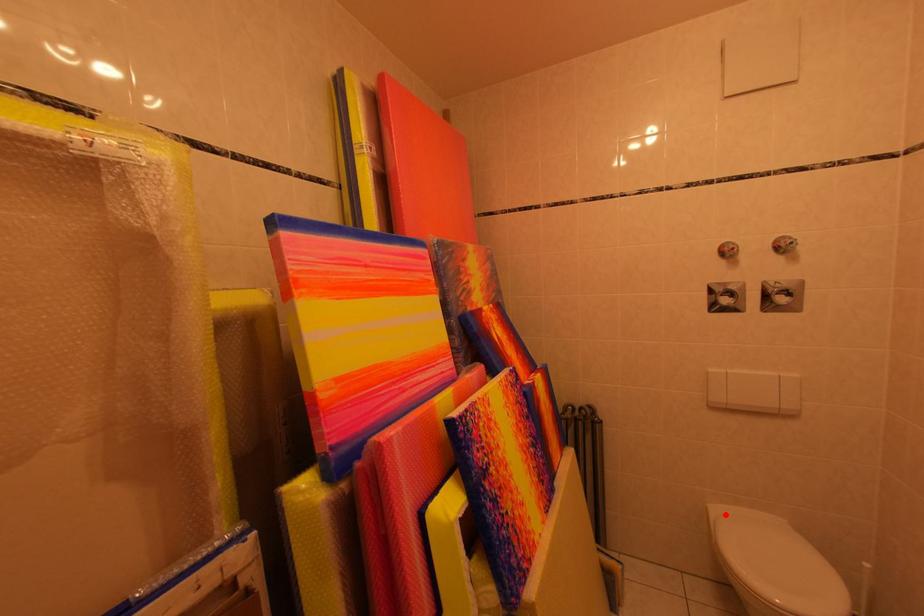
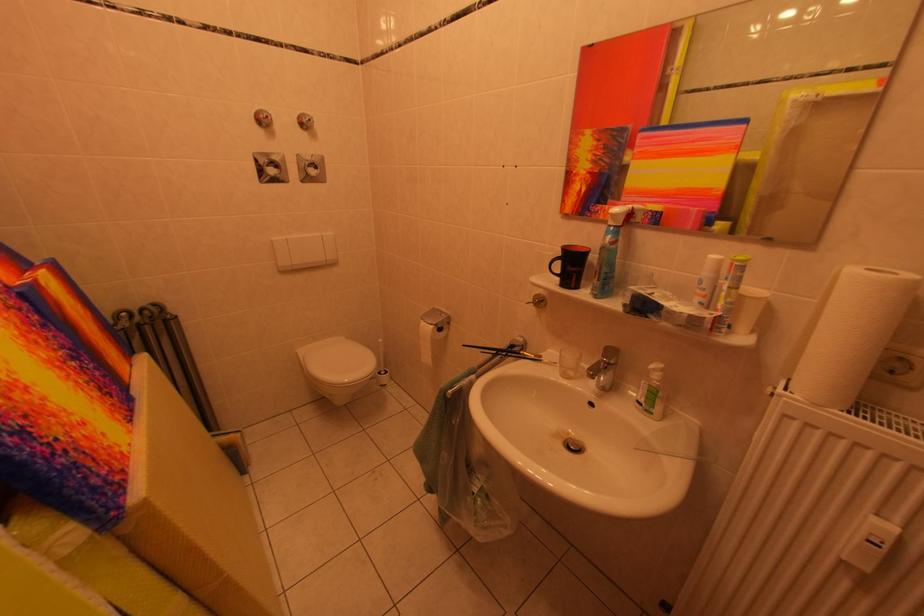
Question: I am providing you with two images of the same scene from different viewpoints. Given a red point in image1, look at the same physical point in image2. Is it:

Choices:
 (A) Closer to the viewpoint
 (B) Farther from the viewpoint

Answer: (A)